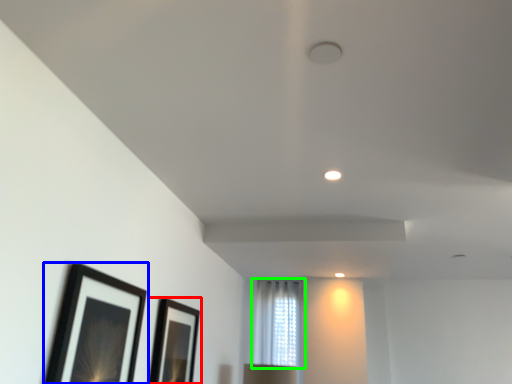
Question: Based on their relative distances, which object is nearer to picture frame (highlighted by a red box)? Choose from picture frame (highlighted by a blue box) and window (highlighted by a green box).

Choices:
 (A) picture frame
 (B) window

Answer: (A)